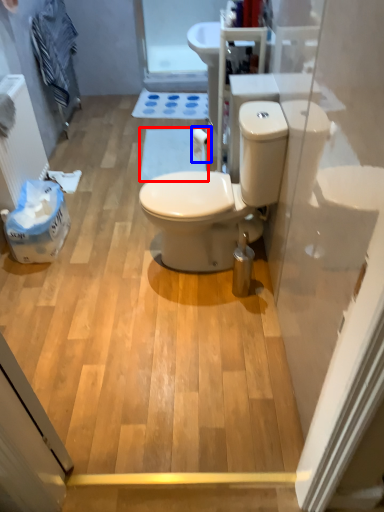
Question: Which of the following is the farthest to the observer, bath mat (highlighted by a red box) or toilet paper (highlighted by a blue box)?

Choices:
 (A) bath mat
 (B) toilet paper

Answer: (A)